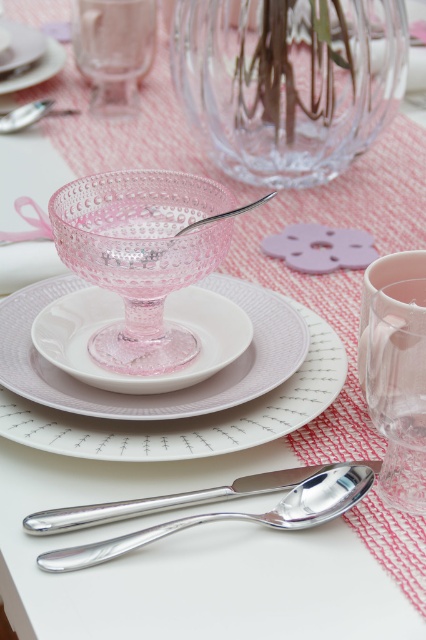
Please look at the table setting. Where is the transparent glass vase at upper center located in the image?

The transparent glass vase at upper center is located at point 0.128 on the horizontal axis and 0.676 on the vertical axis.

You are setting up a table for a dinner party and need to place a decorative centerpiece. Given the current arrangement, where should you place the pink crystal bowl at center to ensure it aligns with the existing table setting?

The pink crystal bowl at center should be placed at point coordinates (141, 257) to align with the existing table setting.

You are arranging flowers for a centerpiece and need to place a bouquet in the transparent glass vase at upper center. To ensure it doesn not block the view of the pink textured glass at center, where should you position the bouquet?

Place the bouquet inside the transparent glass vase at upper center so that it is positioned above the pink textured glass at center, allowing the vase to remain visible without obstructing the view of the pink textured glass below.